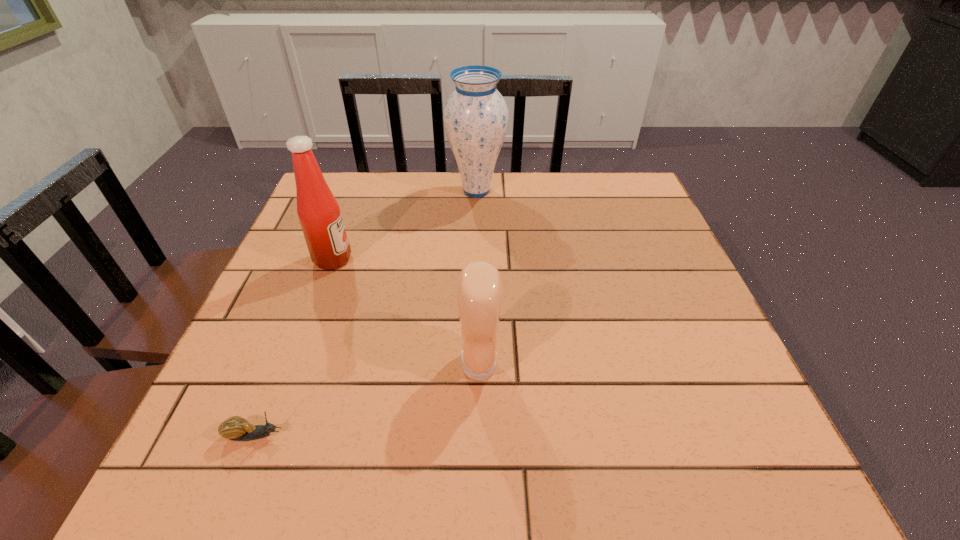
This screenshot has height=540, width=960. What are the coordinates of `object that stands as the closest to the second nearest object` in the screenshot? It's located at (235, 428).